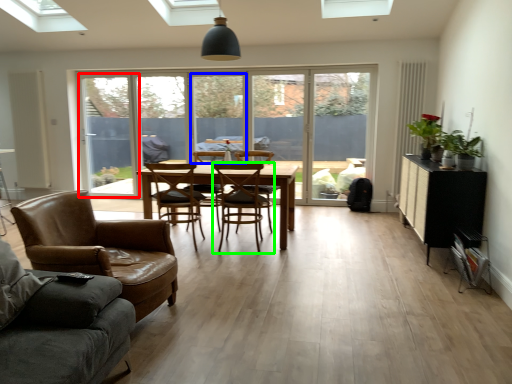
Question: Which is farther away from window screen (highlighted by a red box)? window frame (highlighted by a blue box) or chair (highlighted by a green box)?

Choices:
 (A) window frame
 (B) chair

Answer: (B)